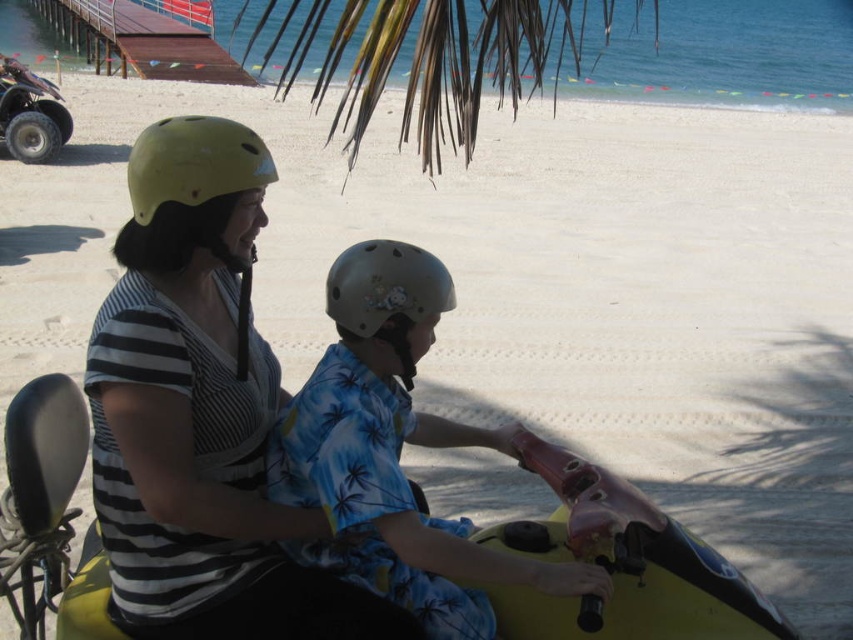
You are a photographer standing on the wooden pier at upper left. You want to take a photo of the blue floral shirt at center and the yellow matte helmet at upper left. Can you fit both subjects in the frame if your camera has a 50 cm wide field of view?

Result: The blue floral shirt at center and yellow matte helmet at upper left are 52.76 centimeters apart. Since the distance between them exceeds the camera field of view of 50 cm, you cannot fit both subjects in the frame.